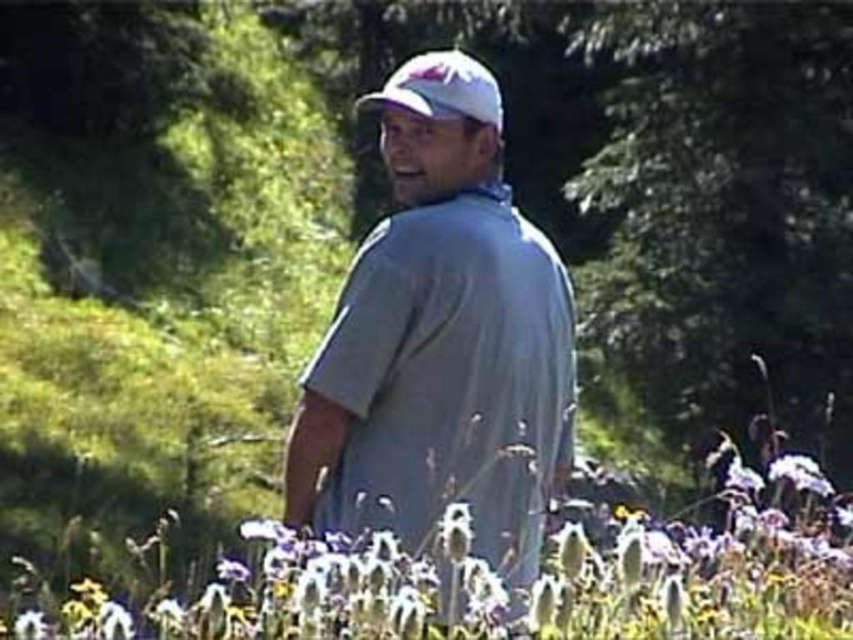
Can you confirm if gray cotton shirt at center is bigger than white fluffy flower at center?

Correct, gray cotton shirt at center is larger in size than white fluffy flower at center.

Between gray cotton shirt at center and white fluffy flower at center, which one is positioned higher?

gray cotton shirt at center is above.

The height and width of the screenshot is (640, 853). Describe the element at coordinates (440, 340) in the screenshot. I see `gray cotton shirt at center` at that location.

I want to click on gray cotton shirt at center, so click(440, 340).

Does white fluffy flower at center appear over white matte hat at center?

Actually, white fluffy flower at center is below white matte hat at center.

Can you confirm if white fluffy flower at center is shorter than white matte hat at center?

Yes.

Between point (306, 618) and point (466, 65), which one is positioned behind?

Point (466, 65)

This screenshot has height=640, width=853. Identify the location of white fluffy flower at center. (483, 579).

Does gray cotton shirt at center have a smaller size compared to white matte hat at center?

Correct, gray cotton shirt at center occupies less space than white matte hat at center.

Is gray cotton shirt at center to the right of white matte hat at center from the viewer's perspective?

Yes, gray cotton shirt at center is to the right of white matte hat at center.

Between point (518, 516) and point (428, 108), which one is positioned in front?

Positioned in front is point (518, 516).

Where is `gray cotton shirt at center`? gray cotton shirt at center is located at coordinates [x=440, y=340].